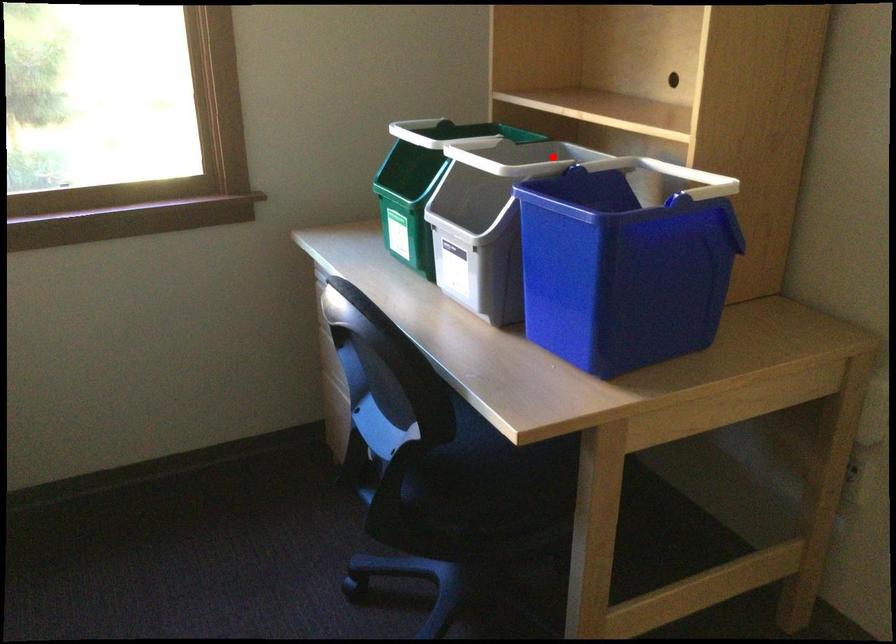
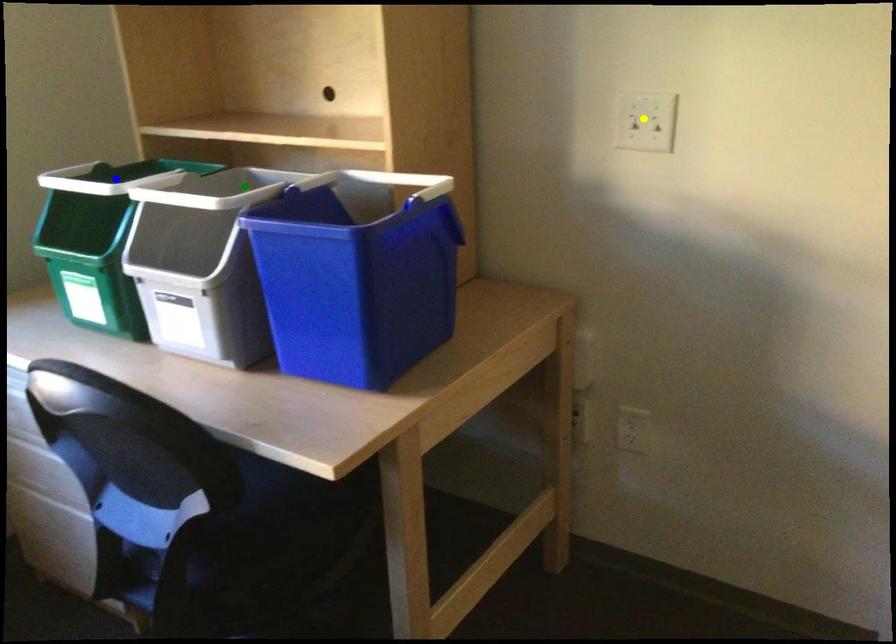
Question: I am providing you with two images of the same scene from different viewpoints. A red point is marked on the first image. You are given multiple points on the second image. In image 2, which mark is for the same physical point as the one in image 1?

Choices:
 (A) blue point
 (B) yellow point
 (C) green point

Answer: (C)